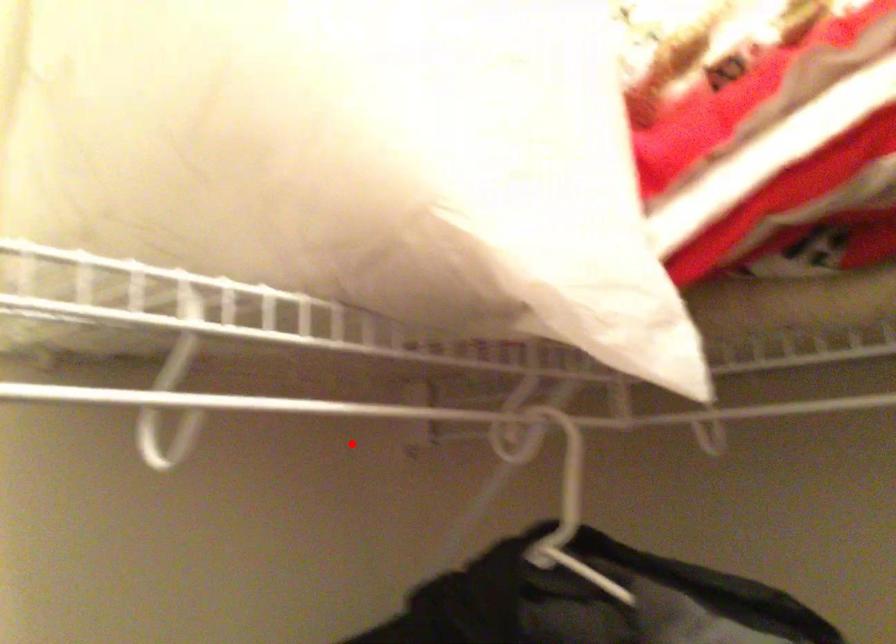
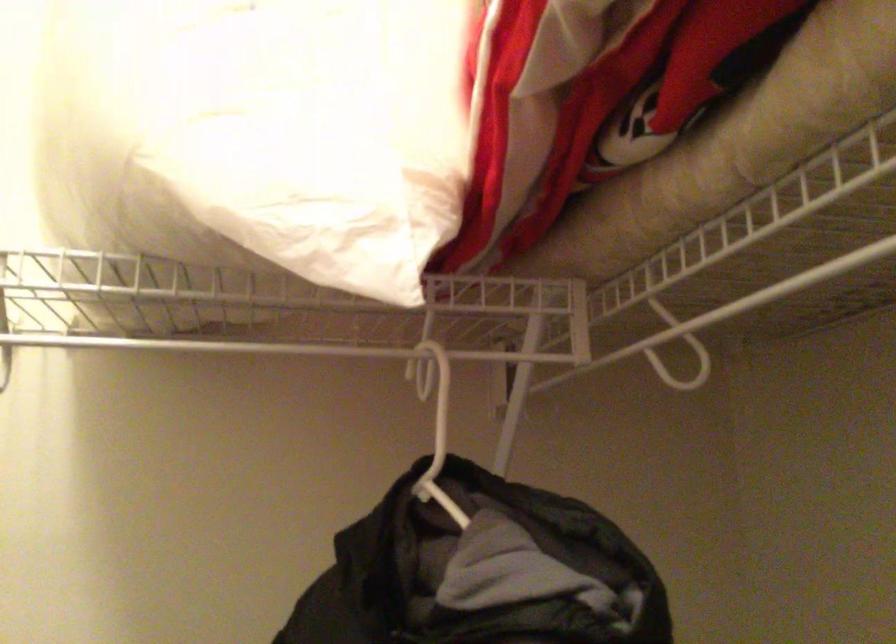
Find the pixel in the second image that matches the highlighted location in the first image.

(436, 404)